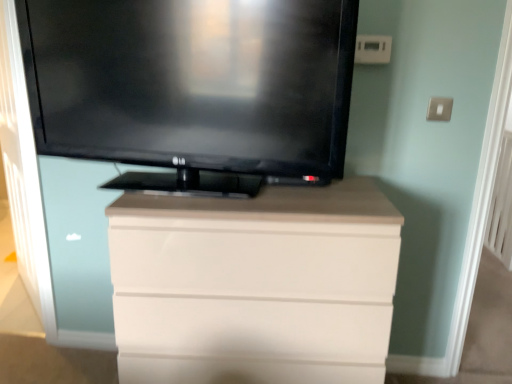
Question: Is black glossy tv at upper center bigger or smaller than white glossy chest of drawers at center?

Choices:
 (A) big
 (B) small

Answer: (B)

Question: In the image, is black glossy tv at upper center positioned in front of or behind white glossy chest of drawers at center?

Choices:
 (A) behind
 (B) front

Answer: (B)

Question: From the image's perspective, relative to white glossy chest of drawers at center, is black glossy tv at upper center above or below?

Choices:
 (A) below
 (B) above

Answer: (B)

Question: From the image's perspective, is white glossy chest of drawers at center above or below black glossy tv at upper center?

Choices:
 (A) below
 (B) above

Answer: (A)

Question: Choose the correct answer: Is white glossy chest of drawers at center inside black glossy tv at upper center or outside it?

Choices:
 (A) outside
 (B) inside

Answer: (A)

Question: Is white glossy chest of drawers at center bigger or smaller than black glossy tv at upper center?

Choices:
 (A) small
 (B) big

Answer: (B)

Question: In the image, is white glossy chest of drawers at center positioned in front of or behind black glossy tv at upper center?

Choices:
 (A) front
 (B) behind

Answer: (B)